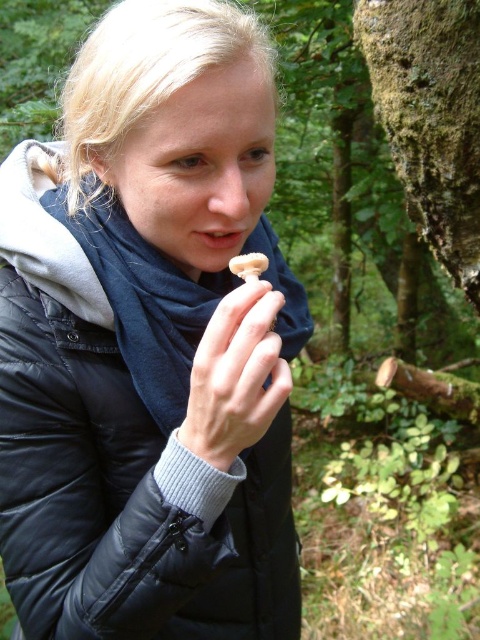
Question: Is smooth skin hand at center positioned before white matte mushroom at center?

Choices:
 (A) no
 (B) yes

Answer: (B)

Question: Which point is closer to the camera?

Choices:
 (A) black quilted jacket at center
 (B) white matte mushroom at center

Answer: (A)

Question: Which point appears farthest from the camera in this image?

Choices:
 (A) (57, 499)
 (B) (247, 276)
 (C) (216, 433)

Answer: (A)

Question: Among these points, which one is farthest from the camera?

Choices:
 (A) coord(219,376)
 (B) coord(227,275)

Answer: (B)

Question: Does black quilted jacket at center have a greater width compared to white matte mushroom at center?

Choices:
 (A) yes
 (B) no

Answer: (A)

Question: Does black quilted jacket at center have a lesser width compared to smooth skin hand at center?

Choices:
 (A) yes
 (B) no

Answer: (B)